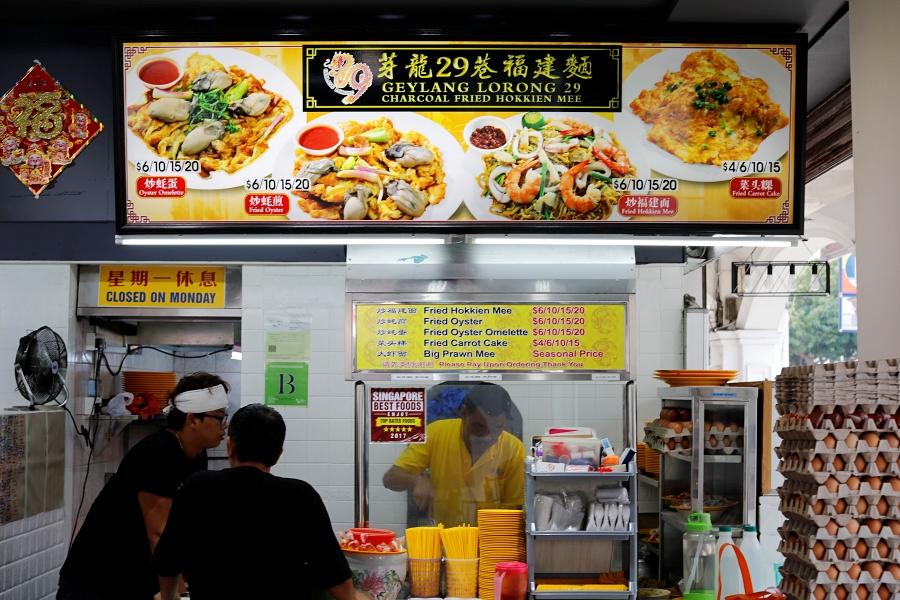
Identify the location of glass/ plastic screen. This screenshot has height=600, width=900. (604, 408).